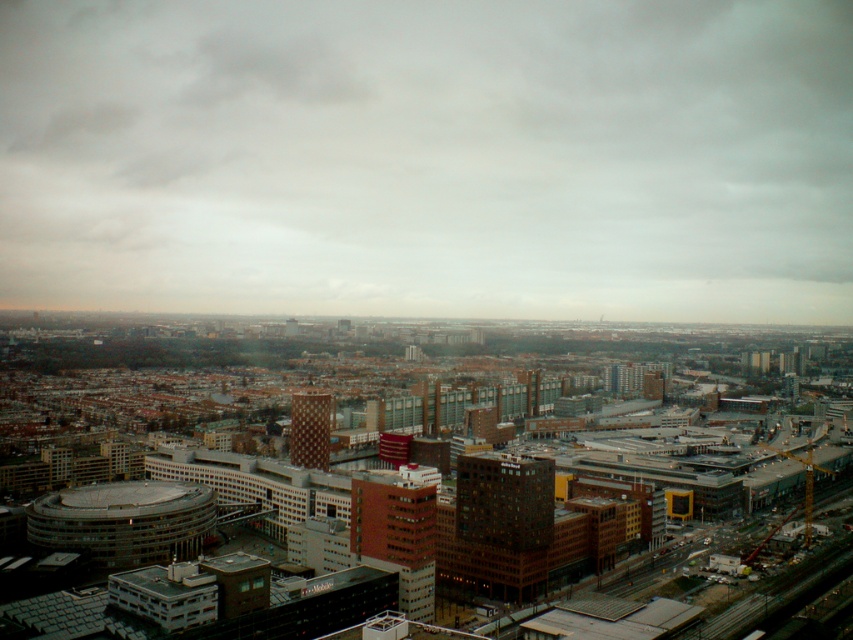
Which is below, brick building at center or brown textured tower at center?

Positioned lower is brown textured tower at center.

Is point (386, 556) closer to viewer compared to point (310, 400)?

That is True.

The image size is (853, 640). What do you see at coordinates (397, 531) in the screenshot? I see `brick building at center` at bounding box center [397, 531].

Locate an element on the screen. The width and height of the screenshot is (853, 640). brick building at center is located at coordinates (397, 531).

Does brown brick building at center have a smaller size compared to brick building at center?

Yes.

Does brown brick building at center appear on the right side of brick building at center?

Indeed, brown brick building at center is positioned on the right side of brick building at center.

Locate an element on the screen. The height and width of the screenshot is (640, 853). brown brick building at center is located at coordinates (500, 522).

Locate an element on the screen. This screenshot has width=853, height=640. brown brick building at center is located at coordinates (500, 522).

Between brown brick building at center and brown textured tower at center, which one is positioned higher?

brown textured tower at center is above.

Is the position of brown brick building at center more distant than that of brown textured tower at center?

No, it is not.

At what (x,y) coordinates should I click in order to perform the action: click on brown brick building at center. Please return your answer as a coordinate pair (x, y). The image size is (853, 640). Looking at the image, I should click on (500, 522).